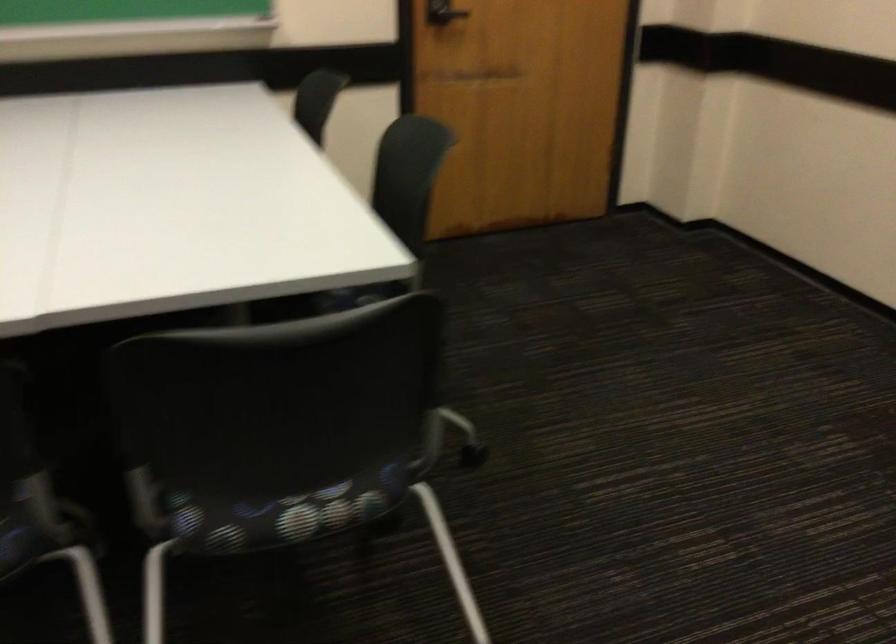
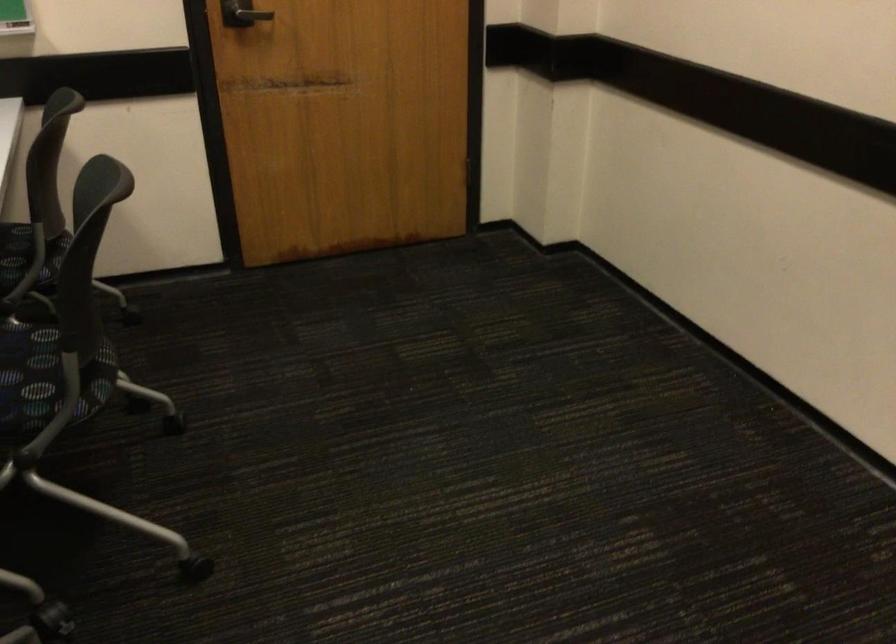
Which direction would the cameraman need to move to produce the second image?

The cameraman moved toward right, forward.